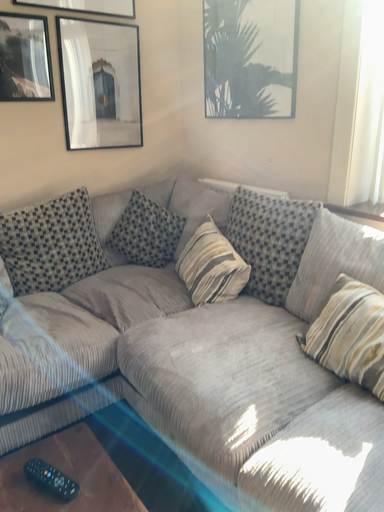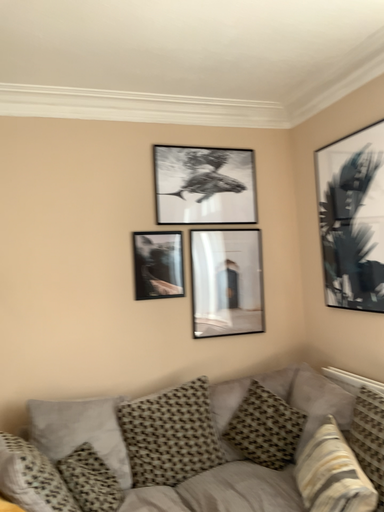
Question: How did the camera likely rotate when shooting the video?

Choices:
 (A) rotated downward
 (B) rotated upward

Answer: (B)